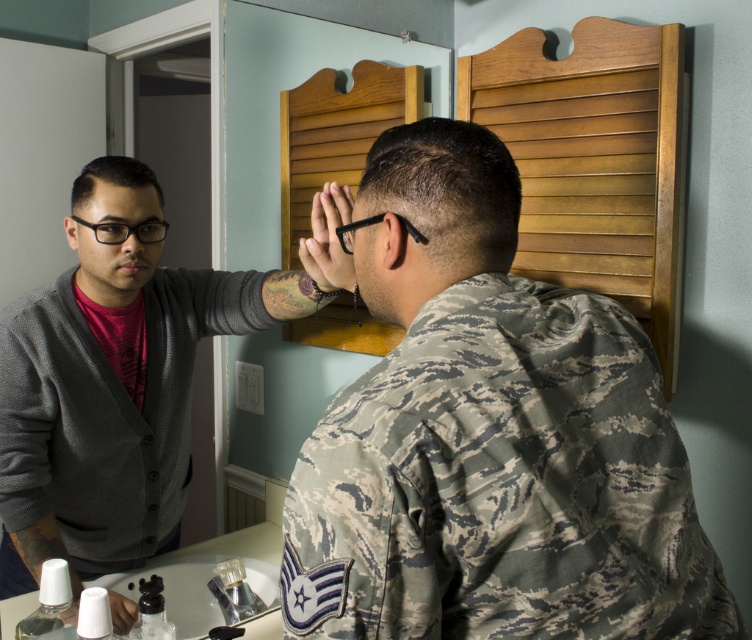
Question: Is gray matte cardigan at left positioned in front of dark brown matte hair at center?

Choices:
 (A) yes
 (B) no

Answer: (B)

Question: Does camouflage fabric uniform at center appear under gray matte cardigan at left?

Choices:
 (A) no
 (B) yes

Answer: (A)

Question: Can you confirm if dark brown matte hair at center is smaller than dark brown hair at left?

Choices:
 (A) yes
 (B) no

Answer: (B)

Question: Which of these objects is positioned closest to the camouflage fabric uniform at center?

Choices:
 (A) dark brown hair at left
 (B) dark brown matte hair at center

Answer: (B)

Question: Estimate the real-world distances between objects in this image. Which object is closer to the dark brown hair at left?

Choices:
 (A) camouflage fabric uniform at center
 (B) gray matte cardigan at left

Answer: (B)

Question: Which object is closer to the camera taking this photo?

Choices:
 (A) camouflage fabric uniform at center
 (B) dark brown hair at left

Answer: (A)